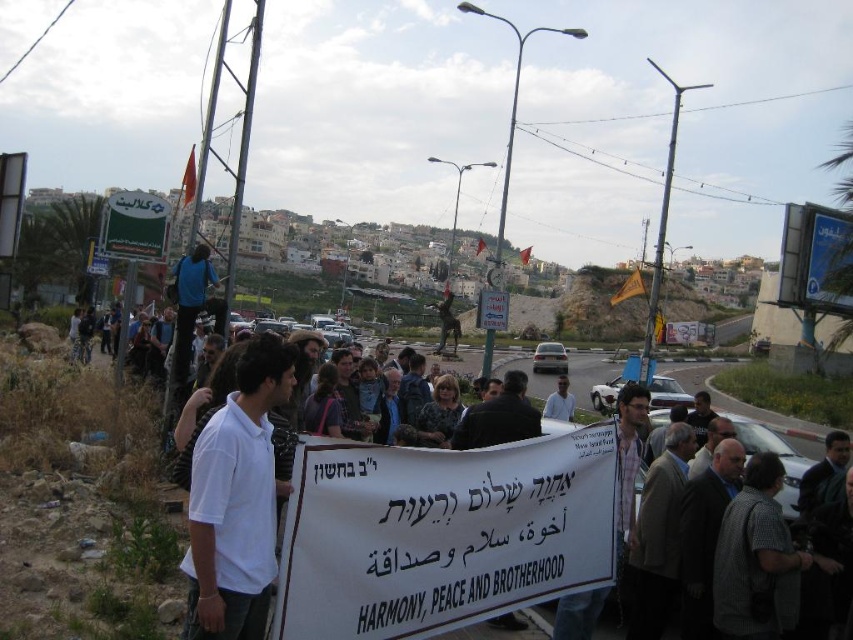
Question: Is white cotton shirt at center above white shirt at center?

Choices:
 (A) yes
 (B) no

Answer: (B)

Question: Is white cotton shirt at center in front of white shirt at center?

Choices:
 (A) yes
 (B) no

Answer: (A)

Question: Which point appears closest to the camera in this image?

Choices:
 (A) (695, 381)
 (B) (270, 538)

Answer: (B)

Question: Which point is farther to the camera?

Choices:
 (A) (219, 451)
 (B) (815, 435)

Answer: (B)

Question: Is white cotton shirt at center to the left of white shirt at center from the viewer's perspective?

Choices:
 (A) yes
 (B) no

Answer: (A)

Question: Which of the following is the closest to the observer?

Choices:
 (A) (229, 536)
 (B) (590, 378)

Answer: (A)